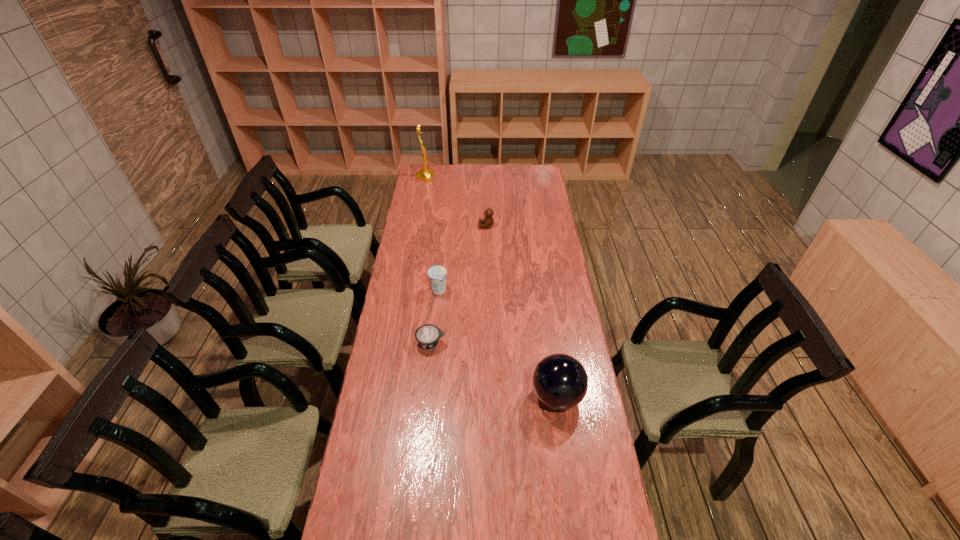
Find the location of a particular element. The height and width of the screenshot is (540, 960). free spot that satisfies the following two spatial constraints: 1. on the front-facing side of the award; 2. on the right side of the taller yogurt is located at coordinates (405, 291).

Where is `free space in the image that satisfies the following two spatial constraints: 1. on the front-facing side of the farthest object; 2. on the back side of the shortest object`? free space in the image that satisfies the following two spatial constraints: 1. on the front-facing side of the farthest object; 2. on the back side of the shortest object is located at coordinates (396, 343).

Locate an element on the screen. This screenshot has height=540, width=960. free region that satisfies the following two spatial constraints: 1. on the face of the fourth nearest object; 2. on the front side of the shortest object is located at coordinates (489, 343).

The image size is (960, 540). In order to click on vacant region that satisfies the following two spatial constraints: 1. on the back side of the taller yogurt; 2. on the right side of the shortest object in this screenshot , I will do `click(437, 291)`.